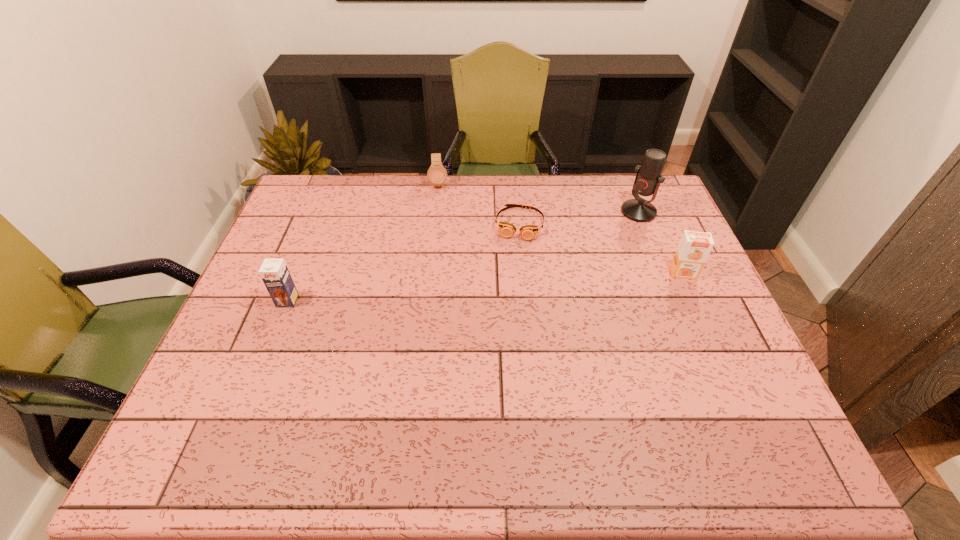
Find the location of `vacant area at the far left corner`. vacant area at the far left corner is located at coordinates (310, 206).

Locate an element on the screen. vacant point at the near left corner is located at coordinates (213, 379).

Image resolution: width=960 pixels, height=540 pixels. Identify the location of free space between the goggles and the leftmost object. (403, 262).

Find the location of a particular element. The width and height of the screenshot is (960, 540). free point between the microphone and the leftmost object is located at coordinates (463, 256).

Locate an element on the screen. vacant space in between the leftmost object and the farthest object is located at coordinates (363, 242).

Identify the location of empty space that is in between the microphone and the orange juice. (660, 242).

The width and height of the screenshot is (960, 540). Identify the location of free spot between the chocolate milk and the fourth object from right to left. (363, 242).

Identify the location of vacant space that is in between the chocolate milk and the tallest object. The width and height of the screenshot is (960, 540). (463, 256).

This screenshot has height=540, width=960. What are the coordinates of `free space that is in between the microphone and the shortest object` in the screenshot? It's located at (579, 218).

Where is `free space between the tallest object and the fourth farthest object`? free space between the tallest object and the fourth farthest object is located at coordinates (660, 242).